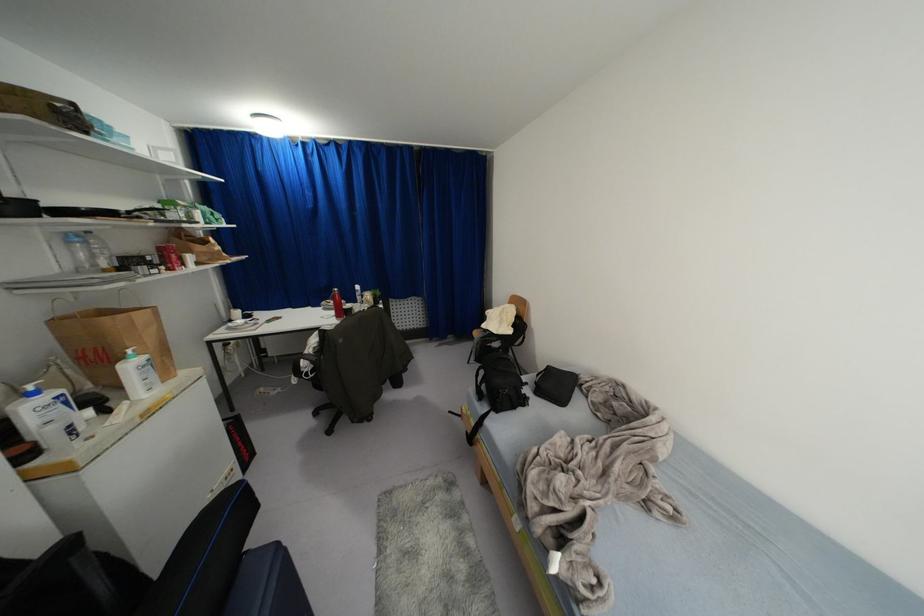
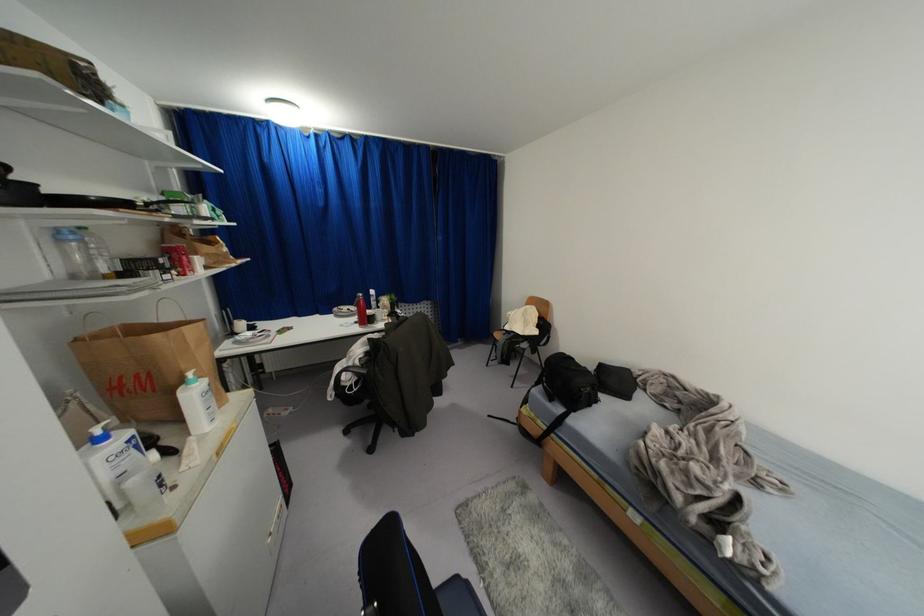
In the second image, find the point that corresponds to [229,321] in the first image.

(234, 333)